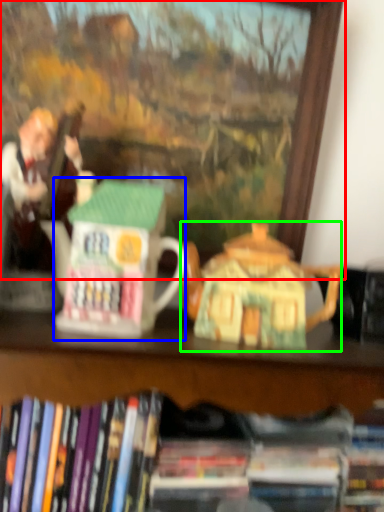
Question: Which is nearer to the picture frame (highlighted by a red box)? toy (highlighted by a blue box) or teapot (highlighted by a green box).

Choices:
 (A) toy
 (B) teapot

Answer: (B)